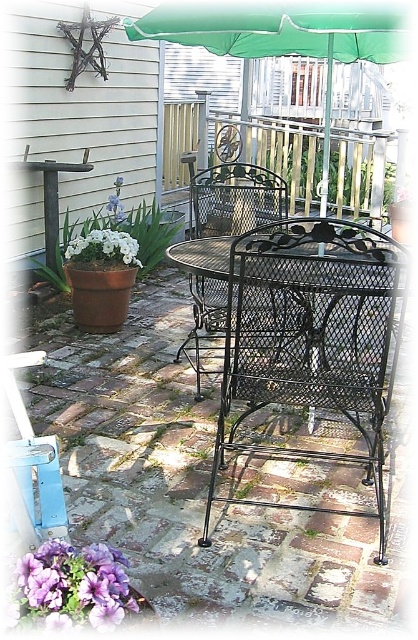
Can you confirm if green fabric umbrella at upper center is shorter than purple petal at lower left?

No, green fabric umbrella at upper center is not shorter than purple petal at lower left.

In the scene shown: Does green fabric umbrella at upper center have a larger size compared to purple petal at lower left?

Yes.

Identify the location of green fabric umbrella at upper center. (283, 36).

Can you confirm if black wrought iron chair at center is thinner than purple petal at lower left?

In fact, black wrought iron chair at center might be wider than purple petal at lower left.

Who is more distant from viewer, (239, 240) or (43, 563)?

Positioned behind is point (239, 240).

Identify the location of black wrought iron chair at center. (313, 339).

This screenshot has width=418, height=640. In order to click on black wrought iron chair at center in this screenshot , I will do `click(313, 339)`.

Between black wrought iron chair at center and black metal chair at center, which one has less height?

With less height is black wrought iron chair at center.

Is black wrought iron chair at center to the right of black metal chair at center from the viewer's perspective?

Indeed, black wrought iron chair at center is positioned on the right side of black metal chair at center.

Locate an element on the screen. The image size is (418, 640). black wrought iron chair at center is located at coordinates (313, 339).